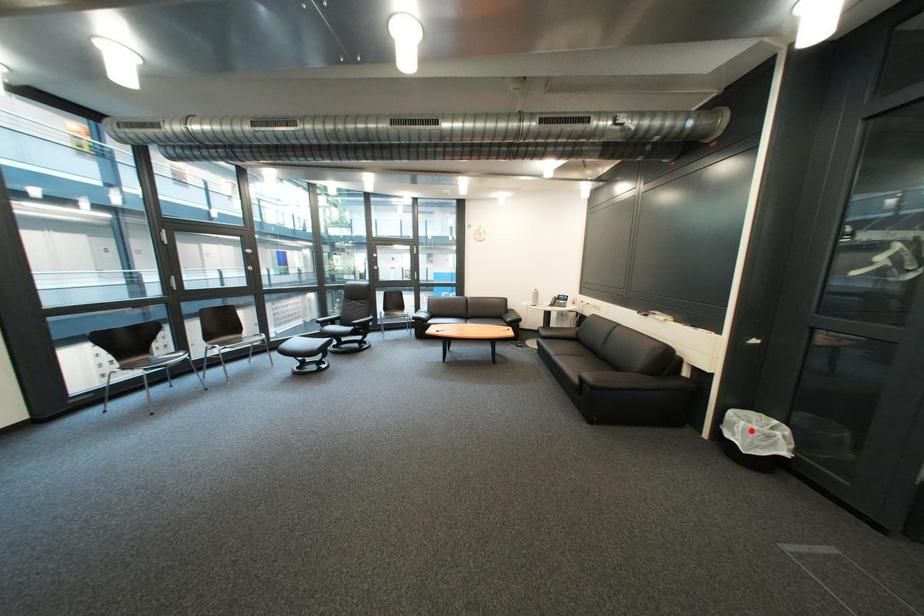
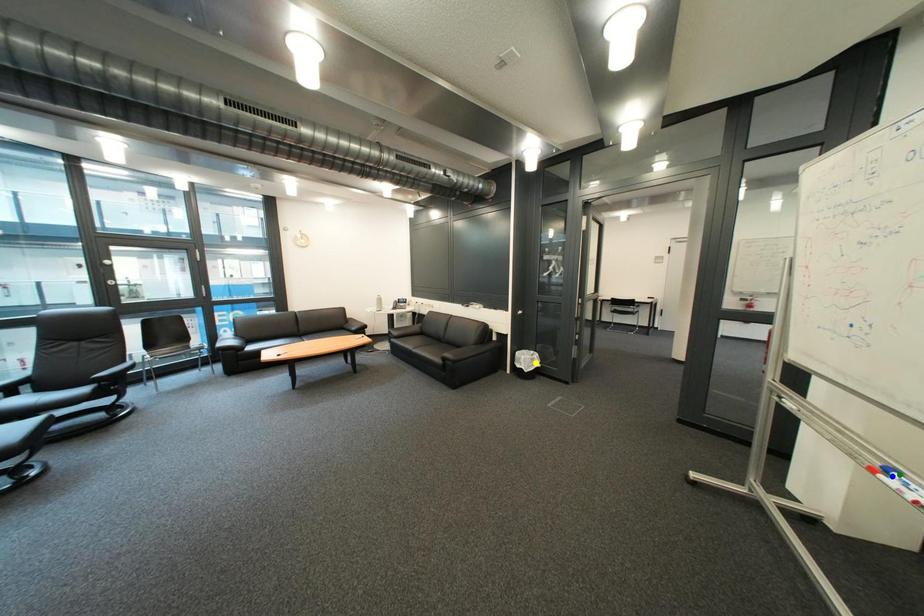
Question: I am providing you with two images of the same scene from different viewpoints. A red point is marked on the first image. You are given multiple points on the second image. In image 2, which mark is for the same physical point as the one in image 1?

Choices:
 (A) green point
 (B) yellow point
 (C) blue point

Answer: (B)